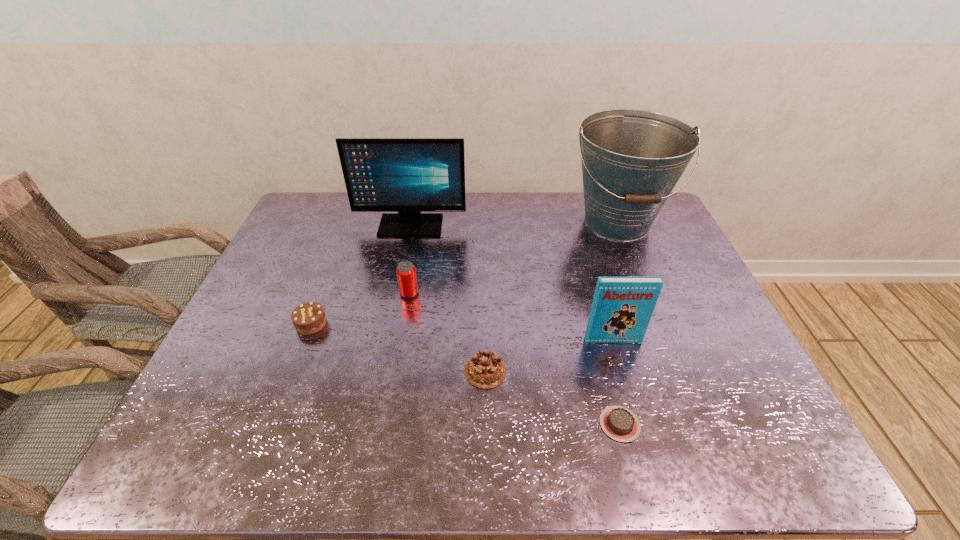
Image resolution: width=960 pixels, height=540 pixels. Find the location of `monitor located at the far edge`. monitor located at the far edge is located at coordinates pyautogui.click(x=406, y=175).

Locate an element on the screen. object that is at the near edge is located at coordinates (619, 423).

Where is `object present at the left edge`? The width and height of the screenshot is (960, 540). object present at the left edge is located at coordinates (x=308, y=318).

Image resolution: width=960 pixels, height=540 pixels. Identify the location of object present at the right edge. (632, 159).

Where is `object that is at the far right corner`? The image size is (960, 540). object that is at the far right corner is located at coordinates (632, 159).

You are a GUI agent. You are given a task and a screenshot of the screen. Output one action in this format:
    pyautogui.click(x=<x>, y=<y>)
    Task: Click on the vacant space at the far edge
    This screenshot has height=540, width=960.
    Given the screenshot: What is the action you would take?
    pyautogui.click(x=540, y=220)

Where is `vacant space at the near edge`? vacant space at the near edge is located at coordinates (329, 459).

I want to click on blank space at the left edge of the desktop, so click(245, 335).

I want to click on vacant space at the right edge of the desktop, so click(x=720, y=329).

In the image, there is a desktop. At what (x,y) coordinates should I click in order to perform the action: click on blank space at the far left corner. Please return your answer as a coordinate pair (x, y). This screenshot has width=960, height=540. Looking at the image, I should click on click(x=312, y=219).